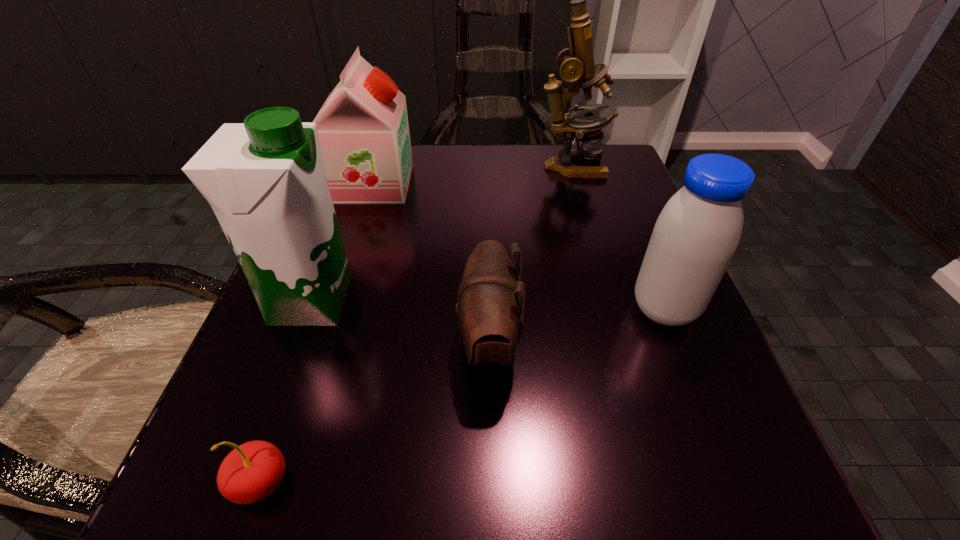
Locate an element on the screen. The height and width of the screenshot is (540, 960). microscope located in the right edge section of the desktop is located at coordinates (576, 64).

Where is `soya milk that is at the right edge`? This screenshot has height=540, width=960. soya milk that is at the right edge is located at coordinates (698, 231).

This screenshot has height=540, width=960. Identify the location of object that is at the far left corner. coord(363,130).

Identify the location of object at the near left corner. (251, 472).

This screenshot has width=960, height=540. What are the coordinates of `object that is at the far right corner` in the screenshot? It's located at (576, 64).

In the image, there is a desktop. At what (x,y) coordinates should I click in order to perform the action: click on vacant space at the far edge. Please return your answer as a coordinate pair (x, y). The image size is (960, 540). Looking at the image, I should click on (500, 153).

This screenshot has width=960, height=540. In the image, there is a desktop. Find the location of `vacant space at the near edge`. vacant space at the near edge is located at coordinates (498, 508).

This screenshot has height=540, width=960. What are the coordinates of `free space at the left edge of the desktop` in the screenshot? It's located at (316, 357).

At what (x,y) coordinates should I click in order to perform the action: click on vacant space at the right edge of the desktop. Please return your answer as a coordinate pair (x, y). This screenshot has height=540, width=960. Looking at the image, I should click on (646, 366).

The width and height of the screenshot is (960, 540). In the image, there is a desktop. In order to click on vacant space at the near left corner in this screenshot , I will do `click(218, 533)`.